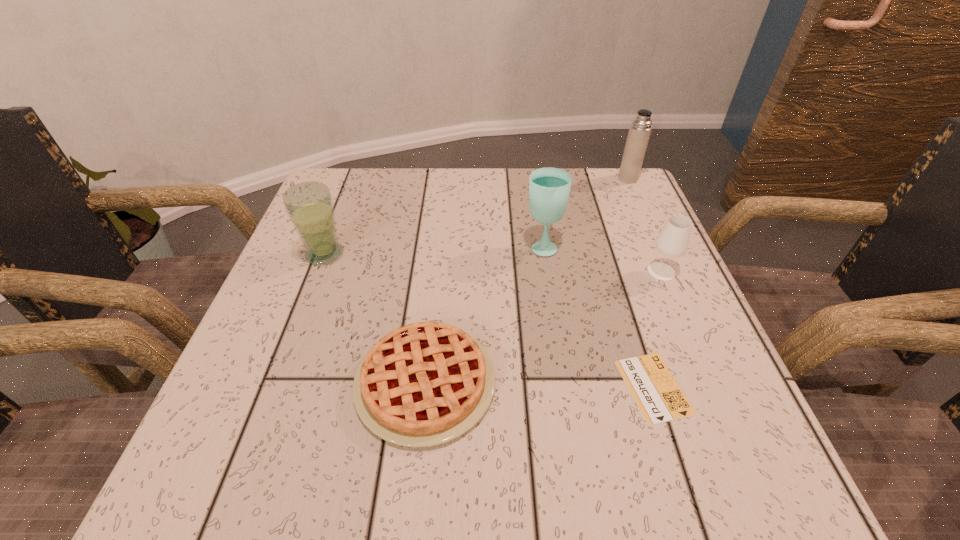
The height and width of the screenshot is (540, 960). Identify the location of blank space located on the back of the fourth object from right to left. (531, 175).

At what (x,y) coordinates should I click in order to perform the action: click on free space located on the back of the leftmost object. Please return your answer as a coordinate pair (x, y). The image size is (960, 540). Looking at the image, I should click on (353, 181).

I want to click on vacant space located on the back of the shortest glass, so (x=633, y=206).

Where is `free spot located on the right of the pie`? free spot located on the right of the pie is located at coordinates (703, 383).

Identify the location of free space located 0.380m on the back of the third object from right to left. This screenshot has height=540, width=960. (599, 219).

The height and width of the screenshot is (540, 960). What are the coordinates of `object that is positioned at the far edge` in the screenshot? It's located at (639, 132).

You are a GUI agent. You are given a task and a screenshot of the screen. Output one action in this format:
    pyautogui.click(x=<x>, y=<y>)
    Task: Click on the object located at the near edge
    
    Given the screenshot: What is the action you would take?
    pyautogui.click(x=423, y=384)

I want to click on object at the left edge, so click(309, 205).

You are a GUI agent. You are given a task and a screenshot of the screen. Output one action in this format:
    pyautogui.click(x=<x>, y=<y>)
    Task: Click on the thermos bottle at the right edge
    The image size is (960, 540).
    Given the screenshot: What is the action you would take?
    639,132

Find the location of a particular element. The width and height of the screenshot is (960, 540). glass present at the right edge is located at coordinates (672, 242).